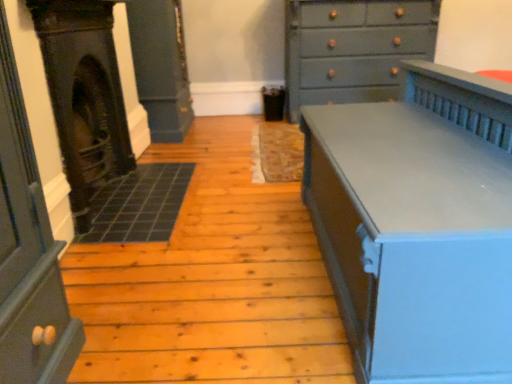
What do you see at coordinates (84, 96) in the screenshot? The height and width of the screenshot is (384, 512). I see `dark gray stone fireplace at left` at bounding box center [84, 96].

The image size is (512, 384). Identify the location of matte gray chest of drawers at upper right, which ranks as the first chest of drawers in back-to-front order. (353, 48).

Based on the photo, from the image's perspective, relative to dark gray stone fireplace at left, is matte gray chest of drawers at right, placed as the first chest of drawers when sorted from front to back, above or below?

Based on their image positions, matte gray chest of drawers at right, placed as the first chest of drawers when sorted from front to back, is located beneath dark gray stone fireplace at left.

Considering the relative positions of matte gray chest of drawers at right, placed as the first chest of drawers when sorted from front to back, and dark gray stone fireplace at left in the image provided, is matte gray chest of drawers at right, placed as the first chest of drawers when sorted from front to back, in front of dark gray stone fireplace at left?

Yes, it is.

Does point (496, 248) come in front of point (63, 84)?

Yes.

How many degrees apart are the facing directions of matte gray chest of drawers at right, placed as the 1th chest of drawers when sorted from bottom to top, and dark gray stone fireplace at left?

matte gray chest of drawers at right, placed as the 1th chest of drawers when sorted from bottom to top, and dark gray stone fireplace at left are facing 179 degrees away from each other.

Which object is more forward, matte gray chest of drawers at right, placed as the 1th chest of drawers when sorted from bottom to top, or matte gray chest of drawers at upper right, positioned as the 2th chest of drawers in bottom-to-top order?

matte gray chest of drawers at right, placed as the 1th chest of drawers when sorted from bottom to top, is more forward.

The height and width of the screenshot is (384, 512). In order to click on chest of drawers located on the right of matte gray chest of drawers at right, placed as the first chest of drawers when sorted from front to back in this screenshot , I will do `click(353, 48)`.

Which object is positioned more to the right, matte gray chest of drawers at upper right, which ranks as the first chest of drawers in back-to-front order, or matte gray chest of drawers at right, which ranks as the 2th chest of drawers in top-to-bottom order?

matte gray chest of drawers at upper right, which ranks as the first chest of drawers in back-to-front order, is more to the right.

Looking at this image, who is taller, matte gray chest of drawers at upper right, which ranks as the first chest of drawers in back-to-front order, or matte gray chest of drawers at right, placed as the first chest of drawers when sorted from front to back?

matte gray chest of drawers at upper right, which ranks as the first chest of drawers in back-to-front order, is taller.

Relative to matte gray chest of drawers at right, which ranks as the 2th chest of drawers in back-to-front order, is matte gray chest of drawers at upper right, which is counted as the first chest of drawers, starting from the top, in front or behind?

matte gray chest of drawers at upper right, which is counted as the first chest of drawers, starting from the top, is behind matte gray chest of drawers at right, which ranks as the 2th chest of drawers in back-to-front order.

Based on the photo, is matte gray chest of drawers at upper right, which ranks as the first chest of drawers in back-to-front order, facing away from matte gray chest of drawers at right, placed as the first chest of drawers when sorted from front to back?

No, matte gray chest of drawers at upper right, which ranks as the first chest of drawers in back-to-front order, is not facing the opposite direction of matte gray chest of drawers at right, placed as the first chest of drawers when sorted from front to back.

Measure the distance between matte gray chest of drawers at upper right, which ranks as the first chest of drawers in back-to-front order, and dark gray stone fireplace at left.

They are 1.97 meters apart.

Is matte gray chest of drawers at upper right, which ranks as the first chest of drawers in back-to-front order, completely or partially outside of dark gray stone fireplace at left?

Yes, matte gray chest of drawers at upper right, which ranks as the first chest of drawers in back-to-front order, is not within dark gray stone fireplace at left.

Is point (375, 4) more distant than point (84, 83)?

Yes, point (375, 4) is farther from viewer.

From the image's perspective, does matte gray chest of drawers at upper right, positioned as the 2th chest of drawers in bottom-to-top order, appear lower than dark gray stone fireplace at left?

Incorrect, from the image's perspective, matte gray chest of drawers at upper right, positioned as the 2th chest of drawers in bottom-to-top order, is higher than dark gray stone fireplace at left.

From the picture: Is dark gray stone fireplace at left oriented away from matte gray chest of drawers at upper right, which is counted as the 2th chest of drawers, starting from the front?

No, dark gray stone fireplace at left is not facing away from matte gray chest of drawers at upper right, which is counted as the 2th chest of drawers, starting from the front.

Visually, is dark gray stone fireplace at left positioned to the left or to the right of matte gray chest of drawers at upper right, positioned as the 2th chest of drawers in bottom-to-top order?

Based on their positions, dark gray stone fireplace at left is located to the left of matte gray chest of drawers at upper right, positioned as the 2th chest of drawers in bottom-to-top order.

Is dark gray stone fireplace at left not near matte gray chest of drawers at upper right, which is counted as the 2th chest of drawers, starting from the front?

That's right, there is a large distance between dark gray stone fireplace at left and matte gray chest of drawers at upper right, which is counted as the 2th chest of drawers, starting from the front.

Between dark gray stone fireplace at left and matte gray chest of drawers at upper right, which ranks as the first chest of drawers in back-to-front order, which one is positioned in front?

dark gray stone fireplace at left is more forward.

Consider the image. How different are the orientations of dark gray stone fireplace at left and matte gray chest of drawers at right, placed as the first chest of drawers when sorted from front to back, in degrees?

There is a 179-degree angle between the facing directions of dark gray stone fireplace at left and matte gray chest of drawers at right, placed as the first chest of drawers when sorted from front to back.

Is dark gray stone fireplace at left oriented towards matte gray chest of drawers at right, placed as the 1th chest of drawers when sorted from bottom to top?

Yes, dark gray stone fireplace at left is turned towards matte gray chest of drawers at right, placed as the 1th chest of drawers when sorted from bottom to top.

Can you confirm if dark gray stone fireplace at left is positioned to the left of matte gray chest of drawers at right, placed as the 1th chest of drawers when sorted from bottom to top?

Yes, dark gray stone fireplace at left is to the left of matte gray chest of drawers at right, placed as the 1th chest of drawers when sorted from bottom to top.

Where is `the chest of drawers that is in front of the dark gray stone fireplace at left`? the chest of drawers that is in front of the dark gray stone fireplace at left is located at coordinates coord(418,225).

The height and width of the screenshot is (384, 512). I want to click on the chest of drawers located above the matte gray chest of drawers at right, which ranks as the 2th chest of drawers in back-to-front order (from the image's perspective), so click(353, 48).

Estimate the real-world distances between objects in this image. Which object is closer to matte gray chest of drawers at right, which ranks as the 2th chest of drawers in back-to-front order, matte gray chest of drawers at upper right, positioned as the 2th chest of drawers in bottom-to-top order, or dark gray stone fireplace at left?

dark gray stone fireplace at left is positioned closer to the anchor matte gray chest of drawers at right, which ranks as the 2th chest of drawers in back-to-front order.

Which object lies nearer to the anchor point matte gray chest of drawers at upper right, which is counted as the first chest of drawers, starting from the top, dark gray stone fireplace at left or matte gray chest of drawers at right, which ranks as the 2th chest of drawers in back-to-front order?

Among the two, matte gray chest of drawers at right, which ranks as the 2th chest of drawers in back-to-front order, is located nearer to matte gray chest of drawers at upper right, which is counted as the first chest of drawers, starting from the top.

Which object lies further to the anchor point matte gray chest of drawers at upper right, which is counted as the first chest of drawers, starting from the top, matte gray chest of drawers at right, which ranks as the 2th chest of drawers in top-to-bottom order, or dark gray stone fireplace at left?

dark gray stone fireplace at left is further to matte gray chest of drawers at upper right, which is counted as the first chest of drawers, starting from the top.

Considering their positions, is matte gray chest of drawers at right, which ranks as the 2th chest of drawers in back-to-front order, positioned further to dark gray stone fireplace at left than matte gray chest of drawers at upper right, which ranks as the first chest of drawers in back-to-front order?

Based on the image, matte gray chest of drawers at upper right, which ranks as the first chest of drawers in back-to-front order, appears to be further to dark gray stone fireplace at left.

Estimate the real-world distances between objects in this image. Which object is closer to dark gray stone fireplace at left, matte gray chest of drawers at upper right, which is counted as the 2th chest of drawers, starting from the front, or matte gray chest of drawers at right, which ranks as the 2th chest of drawers in top-to-bottom order?

Based on the image, matte gray chest of drawers at right, which ranks as the 2th chest of drawers in top-to-bottom order, appears to be nearer to dark gray stone fireplace at left.

Based on their spatial positions, is dark gray stone fireplace at left or matte gray chest of drawers at upper right, positioned as the 2th chest of drawers in bottom-to-top order, further from matte gray chest of drawers at right, placed as the first chest of drawers when sorted from front to back?

Based on the image, matte gray chest of drawers at upper right, positioned as the 2th chest of drawers in bottom-to-top order, appears to be further to matte gray chest of drawers at right, placed as the first chest of drawers when sorted from front to back.

Where is `fireplace between matte gray chest of drawers at right, placed as the first chest of drawers when sorted from front to back, and matte gray chest of drawers at upper right, which is counted as the first chest of drawers, starting from the top, in the front-back direction`? The height and width of the screenshot is (384, 512). fireplace between matte gray chest of drawers at right, placed as the first chest of drawers when sorted from front to back, and matte gray chest of drawers at upper right, which is counted as the first chest of drawers, starting from the top, in the front-back direction is located at coordinates (84, 96).